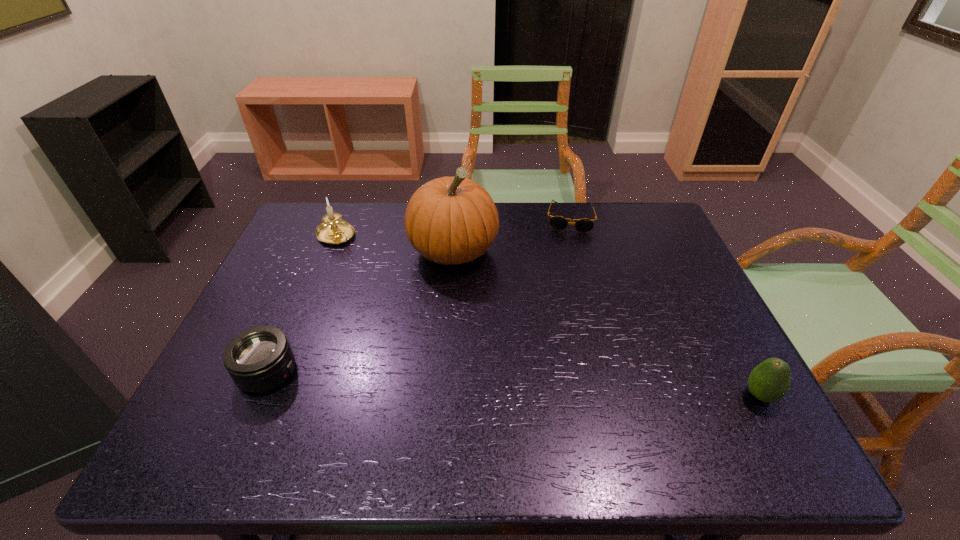
Locate an element on the screen. The width and height of the screenshot is (960, 540). sunglasses located at the far edge is located at coordinates (559, 223).

The height and width of the screenshot is (540, 960). Identify the location of candle holder at the far edge. (333, 230).

I want to click on telephoto lens present at the near edge, so click(258, 359).

At what (x,y) coordinates should I click in order to perform the action: click on avocado that is at the near edge. Please return your answer as a coordinate pair (x, y). Image resolution: width=960 pixels, height=540 pixels. Looking at the image, I should click on (770, 381).

This screenshot has height=540, width=960. What are the coordinates of `telephoto lens that is positioned at the left edge` in the screenshot? It's located at (258, 359).

This screenshot has width=960, height=540. Identify the location of candle holder that is at the left edge. (333, 230).

The height and width of the screenshot is (540, 960). Find the location of `object positioned at the right edge`. object positioned at the right edge is located at coordinates (770, 381).

This screenshot has height=540, width=960. I want to click on object situated at the far left corner, so click(333, 230).

At what (x,y) coordinates should I click in order to perform the action: click on object that is at the near left corner. Please return your answer as a coordinate pair (x, y). This screenshot has width=960, height=540. Looking at the image, I should click on (258, 359).

Where is `object positioned at the near right corner`? object positioned at the near right corner is located at coordinates (770, 381).